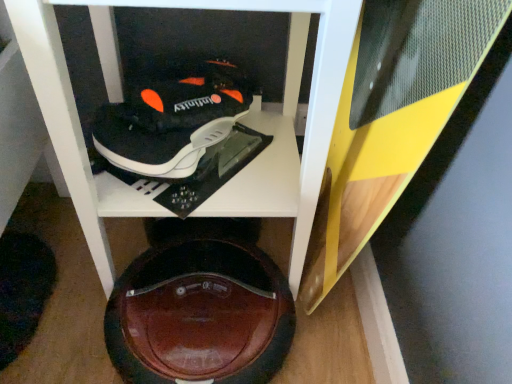
Question: Is black matte shoe at upper center facing away from shiny brown shoe at bottom center?

Choices:
 (A) yes
 (B) no

Answer: (B)

Question: Is black matte shoe at upper center positioned before shiny brown shoe at bottom center?

Choices:
 (A) no
 (B) yes

Answer: (B)

Question: Can you confirm if black matte shoe at upper center is smaller than shiny brown shoe at bottom center?

Choices:
 (A) yes
 (B) no

Answer: (A)

Question: Is black matte shoe at upper center in contact with shiny brown shoe at bottom center?

Choices:
 (A) no
 (B) yes

Answer: (A)

Question: Is black matte shoe at upper center shorter than shiny brown shoe at bottom center?

Choices:
 (A) yes
 (B) no

Answer: (B)

Question: In the image, is black matte shoe at upper center on the left side or the right side of shiny brown shoe at bottom center?

Choices:
 (A) left
 (B) right

Answer: (A)

Question: Is point (225, 114) closer or farther from the camera than point (160, 377)?

Choices:
 (A) farther
 (B) closer

Answer: (A)

Question: Is black matte shoe at upper center taller or shorter than shiny brown shoe at bottom center?

Choices:
 (A) short
 (B) tall

Answer: (B)

Question: From the image's perspective, is black matte shoe at upper center located above or below shiny brown shoe at bottom center?

Choices:
 (A) above
 (B) below

Answer: (A)

Question: From a real-world perspective, is wooden cabinet at center physically located above or below black matte shoe at upper center?

Choices:
 (A) below
 (B) above

Answer: (A)

Question: Is point (224, 193) positioned closer to the camera than point (204, 82)?

Choices:
 (A) farther
 (B) closer

Answer: (A)

Question: Is wooden cabinet at center situated inside black matte shoe at upper center or outside?

Choices:
 (A) outside
 (B) inside

Answer: (A)

Question: Looking at their shapes, would you say wooden cabinet at center is wider or thinner than black matte shoe at upper center?

Choices:
 (A) wide
 (B) thin

Answer: (A)

Question: From their relative heights in the image, would you say shiny brown shoe at bottom center is taller or shorter than wooden cabinet at center?

Choices:
 (A) tall
 (B) short

Answer: (B)

Question: Considering the positions of shiny brown shoe at bottom center and wooden cabinet at center in the image, is shiny brown shoe at bottom center wider or thinner than wooden cabinet at center?

Choices:
 (A) thin
 (B) wide

Answer: (A)